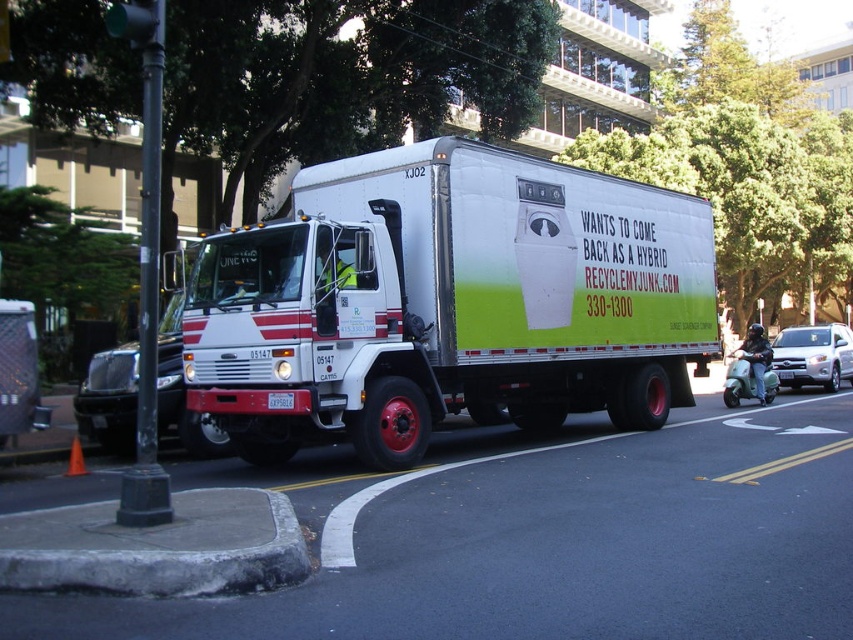
Question: Considering the relative positions of gray concrete curb at lower left and silver metallic suv at right in the image provided, where is gray concrete curb at lower left located with respect to silver metallic suv at right?

Choices:
 (A) above
 (B) below

Answer: (B)

Question: Is white matte truck at center to the right of gray concrete curb at lower left from the viewer's perspective?

Choices:
 (A) no
 (B) yes

Answer: (B)

Question: Is white matte truck at center positioned at the back of gray concrete curb at lower left?

Choices:
 (A) yes
 (B) no

Answer: (A)

Question: Which object is positioned closest to the white plastic license plate at center?

Choices:
 (A) white matte truck at center
 (B) silver metallic suv at right
 (C) gray concrete curb at lower left

Answer: (C)

Question: Which of these objects is positioned farthest from the white matte truck at center?

Choices:
 (A) gray concrete curb at lower left
 (B) silver metallic suv at right
 (C) white plastic license plate at center

Answer: (B)

Question: Which object is farther from the camera taking this photo?

Choices:
 (A) gray concrete curb at lower left
 (B) white matte truck at center
 (C) white plastic license plate at center
 (D) silver metallic suv at right

Answer: (D)